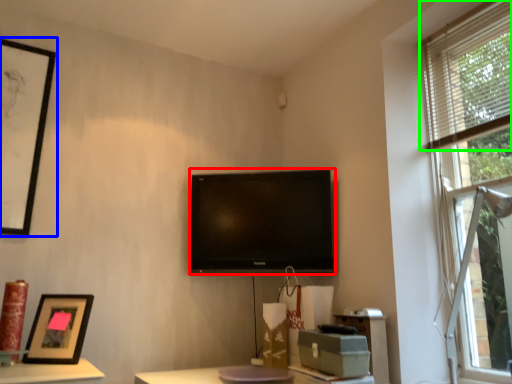
Question: Which object is the farthest from television (highlighted by a red box)? Choose among these: picture frame (highlighted by a blue box) or blind (highlighted by a green box).

Choices:
 (A) picture frame
 (B) blind

Answer: (A)